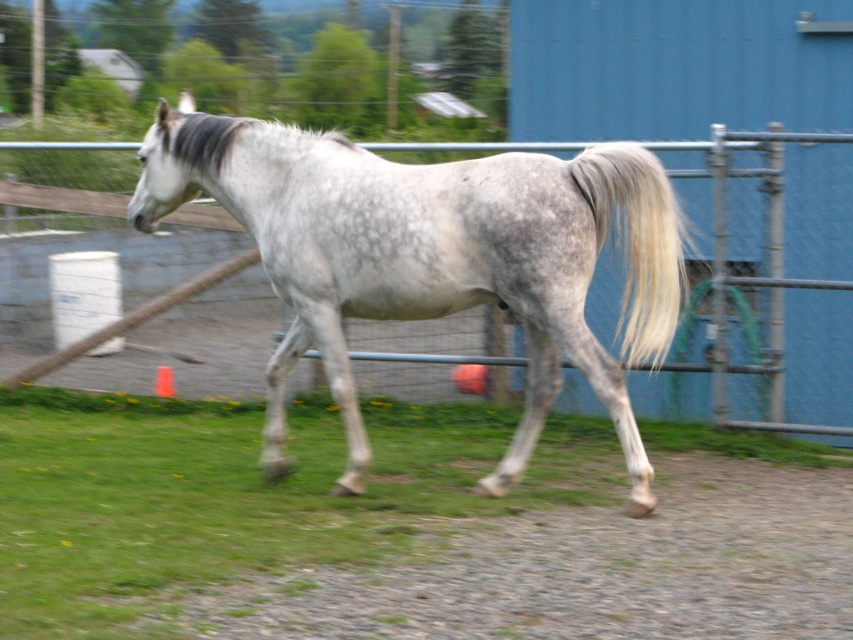
You are a photographer trying to capture the gray speckled horse at center and the gray silky tail at right in a single frame. Based on their sizes, which object should you focus on to ensure both fit comfortably in the photo?

The gray speckled horse at center is larger in width than the gray silky tail at right, so focusing on the horse will ensure both fit comfortably in the photo.

You are a photographer trying to capture the horse in motion. You notice the green grass at lower center and the gray silky tail at right. Which object is closer to the left side of your camera frame?

The green grass at lower center is positioned on the left side of the gray silky tail at right, so the green grass at lower center is closer to the left side of the camera frame.

You are a photographer trying to capture a photo of the gray speckled horse at center. You notice the green grass at lower center is blocking part of the horse. Can you adjust your position to move the grass out of the frame without moving the horse?

The green grass at lower center is positioned on the left side of gray speckled horse at center. To move the grass out of the frame, you can shift your camera position to the left so that the grass is no longer visible while keeping the horse centered.